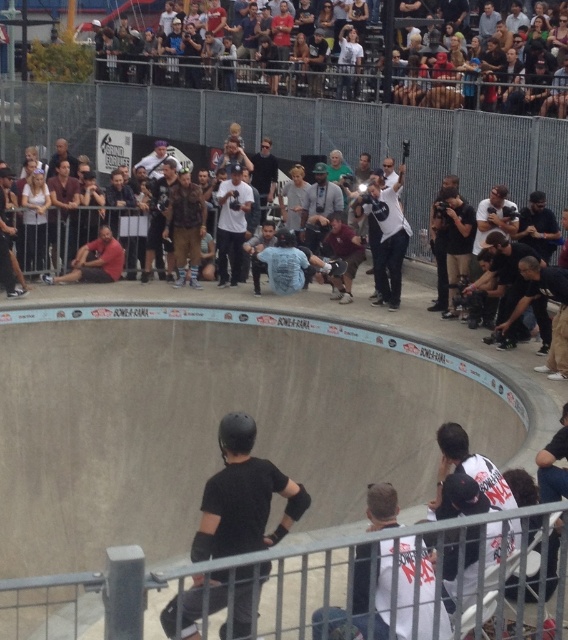
Question: Is dark gray concrete crowd at upper center above black matte helmet at center?

Choices:
 (A) no
 (B) yes

Answer: (B)

Question: Is metallic gray rail at lower center wider than camouflage jacket at center?

Choices:
 (A) no
 (B) yes

Answer: (B)

Question: Which point is closer to the camera?

Choices:
 (A) metallic gray rail at lower center
 (B) matte black helmet at center
 (C) white cotton shirt at center
 (D) smooth concrete bowl at center

Answer: (A)

Question: Which of these objects is positioned farthest from the metallic gray rail at lower center?

Choices:
 (A) metallic silver skateboard at center
 (B) matte black helmet at center
 (C) smooth concrete bowl at center

Answer: (B)

Question: Which object is closer to the camera taking this photo?

Choices:
 (A) dark gray concrete crowd at upper center
 (B) white cotton tank top at upper left
 (C) matte black helmet at center
 (D) white cotton shirt at center

Answer: (A)

Question: Does matte black helmet at center appear over black matte skateboard at center?

Choices:
 (A) no
 (B) yes

Answer: (B)